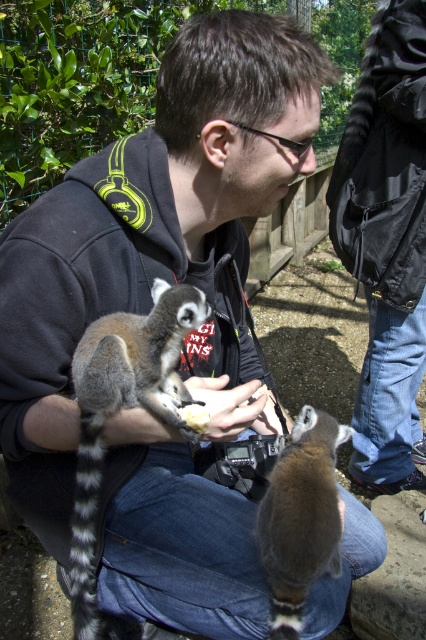
Question: Is black synthetic jacket at upper right above ring-tailed lemur at left?

Choices:
 (A) no
 (B) yes

Answer: (B)

Question: Which point is farther from the camera taking this photo?

Choices:
 (A) (187, 396)
 (B) (321, 513)
 (C) (406, 125)

Answer: (C)

Question: Observing the image, what is the correct spatial positioning of black synthetic jacket at upper right in reference to ring-tailed lemur at left?

Choices:
 (A) above
 (B) below

Answer: (A)

Question: Which point appears farthest from the camera in this image?

Choices:
 (A) (164, 339)
 (B) (299, 474)

Answer: (B)

Question: Which point is closer to the camera taking this photo?

Choices:
 (A) (108, 362)
 (B) (296, 516)
 (C) (362, 172)

Answer: (A)

Question: Can you confirm if black synthetic jacket at upper right is bigger than ring-tailed lemur at center?

Choices:
 (A) yes
 (B) no

Answer: (A)